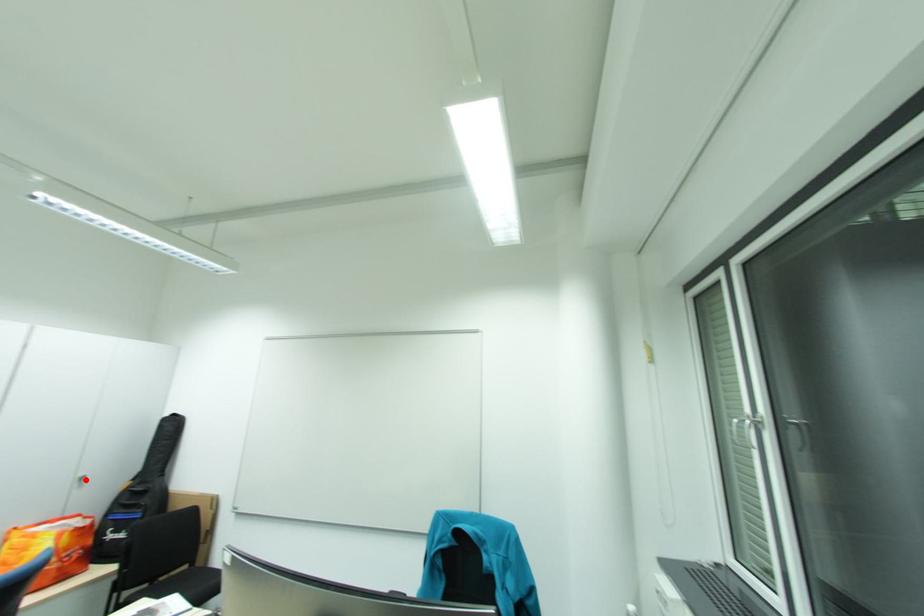
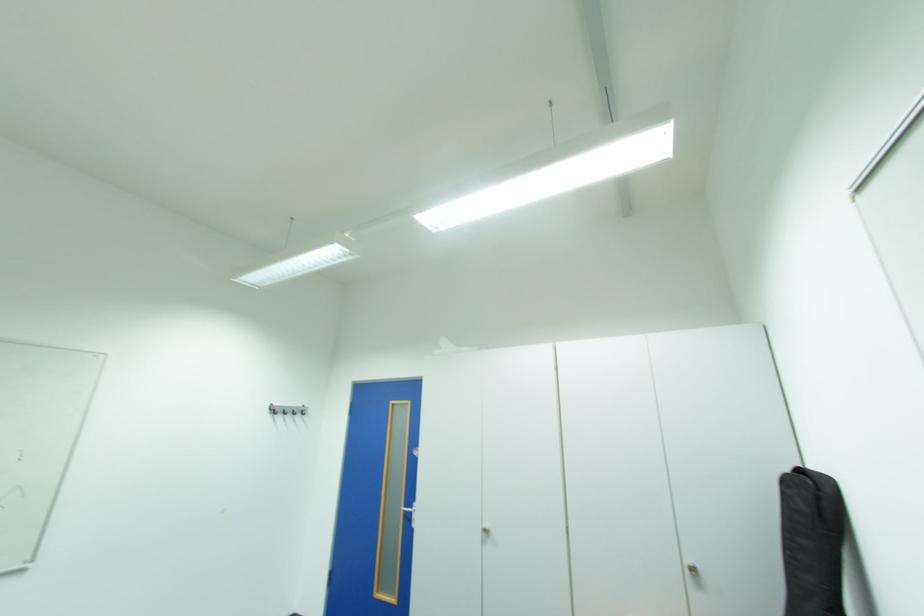
Locate, in the second image, the point that corresponds to the highlighted location in the first image.

(697, 570)